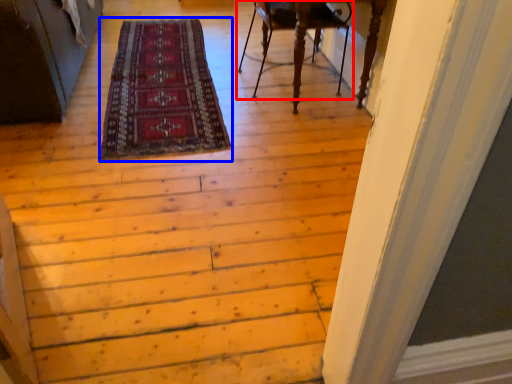
Question: Which object is further to the camera taking this photo, chair (highlighted by a red box) or mat (highlighted by a blue box)?

Choices:
 (A) chair
 (B) mat

Answer: (A)